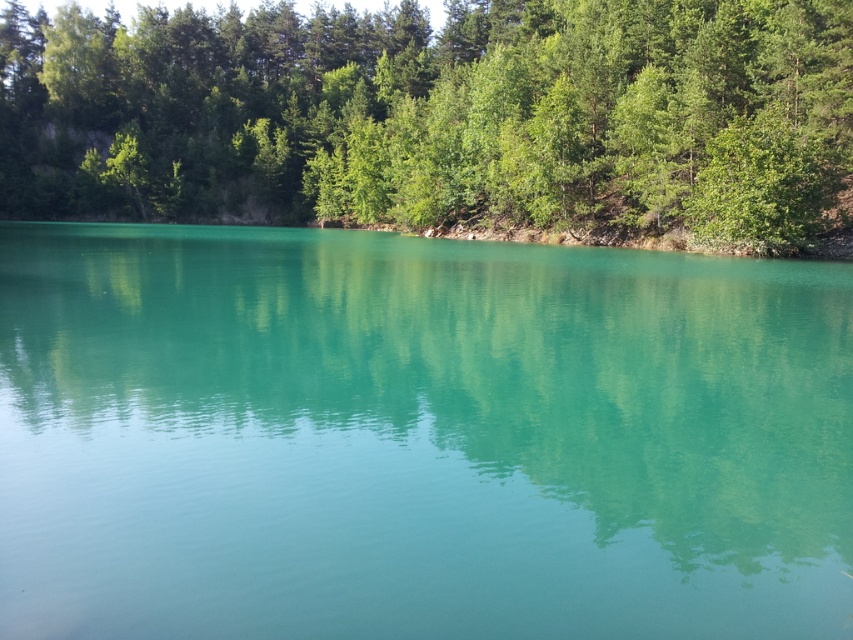
You are a photographer wanting to capture the reflection of the green leafy trees at upper center in the turquoise glossy water at center. Based on the scene, can you determine if the water surface is large enough to fully reflect the trees?

The turquoise glossy water at center occupies less space than green leafy trees at upper center, so the water surface may not be large enough to fully reflect the trees.

You are a photographer aiming to capture the reflection of the green leafy trees at upper center in the turquoise glossy water at center. Based on the scene description, can you confirm if the trees are positioned in a way that their reflection would be visible in the water?

The turquoise glossy water at center is positioned under green leafy trees at upper center, so their reflection should be visible in the water since the water is directly beneath the trees.